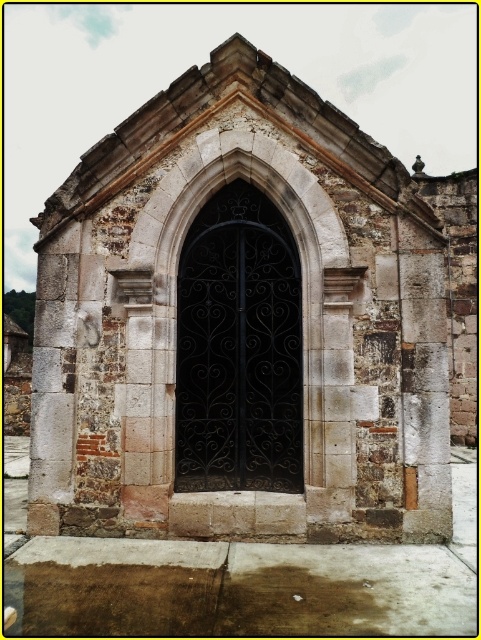
You are an architect designing a new gate for a historical building. You need to ensure that the new wrought iron gate will fit within the existing stone arch. Based on the image, will the height of the black wrought iron door at center allow it to fit under the stone arched door at center?

The stone arched door at center is not as tall as the black wrought iron door at center, meaning the wrought iron door is taller. Therefore, the black wrought iron door at center cannot fit under the stone arched door at center due to its greater height.

Based on the photo, you are an architect examining the stone structure. You notice the stone arched door at center and the black wrought iron door at center. Based on their positions, which one is positioned higher up in the image?

The black wrought iron door at center is positioned higher up because the stone arched door at center is located below it.